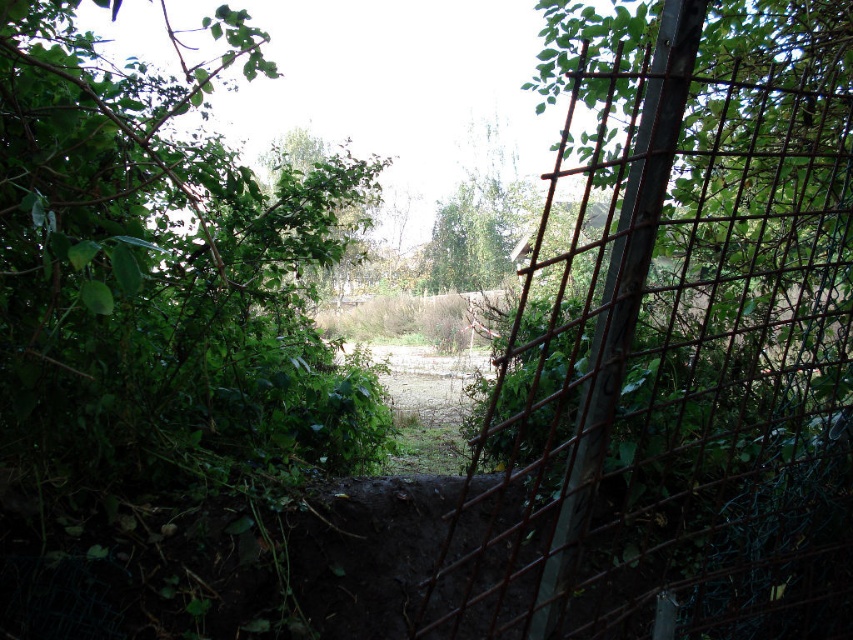
You are a gardener standing at the entrance of the garden. You need to place a new decorative statue that is 3 feet wide between the rusty metal trellis at center right and the green leafy tree at center. Is there enough space between them to place the statue without it touching either object?

The rusty metal trellis at center right is 26.23 feet away from the green leafy tree at center. Since the statue is only 3 feet wide, there is ample space between them to place the statue without it touching either object.

You are a gardener trying to prune the green leafy tree at center. You notice the rusty metal trellis at center right nearby. Which direction should you move to get a better view of the tree without the trellis blocking your view?

The rusty metal trellis at center right is positioned on the right side of the green leafy tree at center. To avoid the trellis blocking your view, you should move to the left side of the green leafy tree at center.